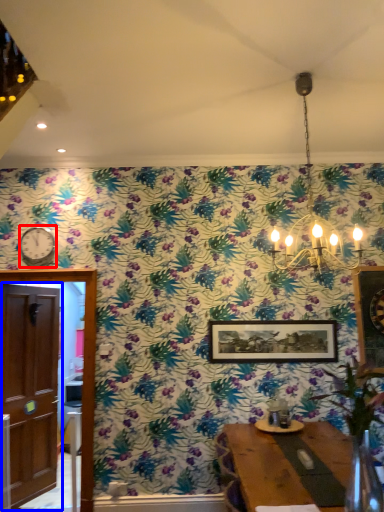
Question: Which object is further to the camera taking this photo, clock (highlighted by a red box) or door (highlighted by a blue box)?

Choices:
 (A) clock
 (B) door

Answer: (A)